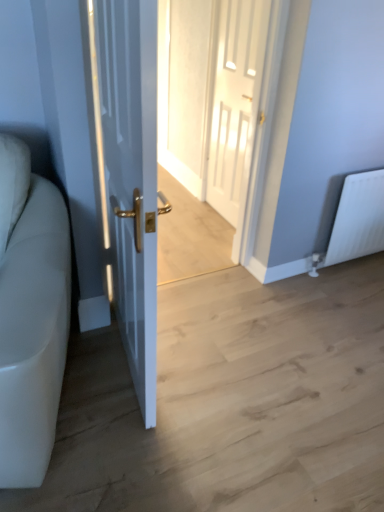
Question: Which is correct: white matte radiator at right is inside white glossy door at left, the first door positioned from the front, or outside of it?

Choices:
 (A) outside
 (B) inside

Answer: (A)

Question: From their relative heights in the image, would you say white matte radiator at right is taller or shorter than white glossy door at left, positioned as the first door in left-to-right order?

Choices:
 (A) tall
 (B) short

Answer: (B)

Question: Considering the real-world distances, which object is closest to the white matte radiator at right?

Choices:
 (A) white glossy door at center, the 2th door when ordered from front to back
 (B) white glossy door at center
 (C) white glossy door at left, the 2th door in the back-to-front sequence
 (D) white leather couch at left

Answer: (A)

Question: Considering the real-world distances, which object is farthest from the white leather couch at left?

Choices:
 (A) white glossy door at left, which is the second door from right to left
 (B) white glossy door at center, the 2th door when ordered from front to back
 (C) white matte radiator at right
 (D) white glossy door at center

Answer: (C)